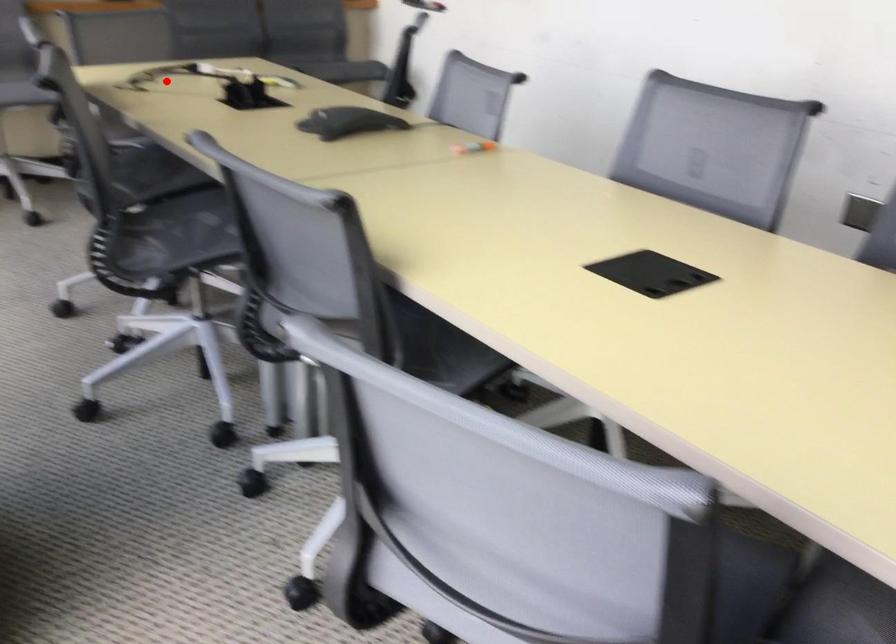
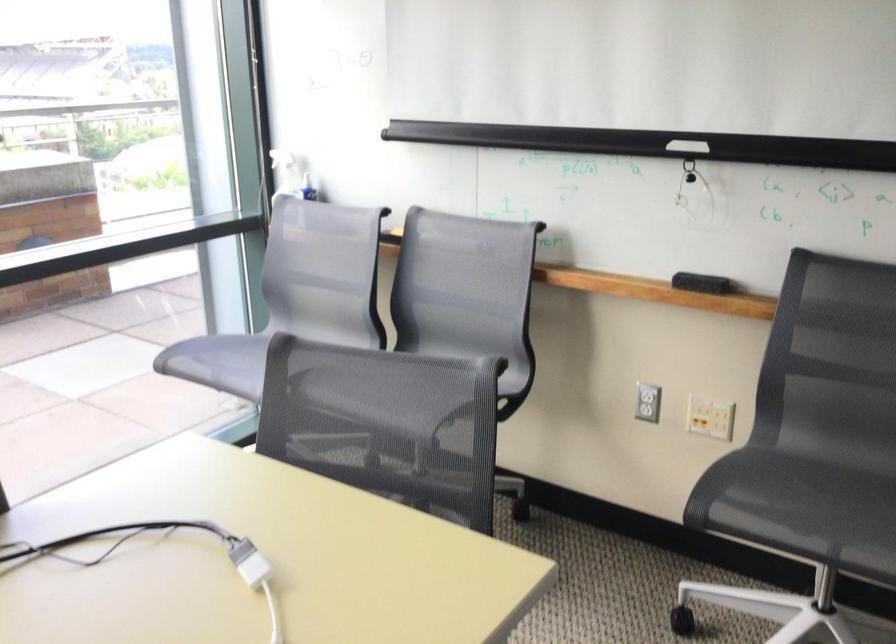
Question: I am providing you with two images of the same scene from different viewpoints. Image1 has a red point marked. In image2, the corresponding 3D location appears at what relative position? Reply with the corresponding letter.

Choices:
 (A) Closer
 (B) Farther

Answer: (A)